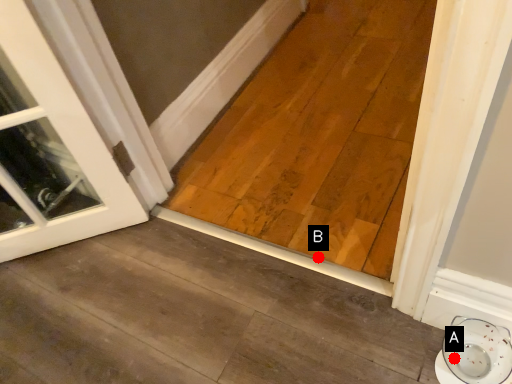
Question: Two points are circled on the image, labeled by A and B beside each circle. Which point is closer to the camera?

Choices:
 (A) A is closer
 (B) B is closer

Answer: (A)